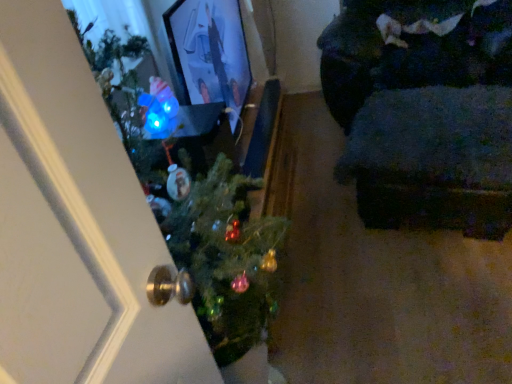
Question: Is dark fabric couch at right in front of or behind green matte christmas tree at center in the image?

Choices:
 (A) behind
 (B) front

Answer: (A)

Question: Considering the positions of dark fabric couch at right and green matte christmas tree at center in the image, is dark fabric couch at right bigger or smaller than green matte christmas tree at center?

Choices:
 (A) small
 (B) big

Answer: (B)

Question: Is dark fabric couch at right inside the boundaries of green matte christmas tree at center, or outside?

Choices:
 (A) outside
 (B) inside

Answer: (A)

Question: From a real-world perspective, is green matte christmas tree at center above or below dark fabric couch at right?

Choices:
 (A) below
 (B) above

Answer: (B)

Question: Looking at the image, does green matte christmas tree at center seem bigger or smaller compared to dark fabric couch at right?

Choices:
 (A) big
 (B) small

Answer: (B)

Question: From the image's perspective, relative to dark fabric couch at right, is green matte christmas tree at center above or below?

Choices:
 (A) below
 (B) above

Answer: (A)

Question: In the image, is green matte christmas tree at center positioned in front of or behind dark fabric couch at right?

Choices:
 (A) front
 (B) behind

Answer: (A)